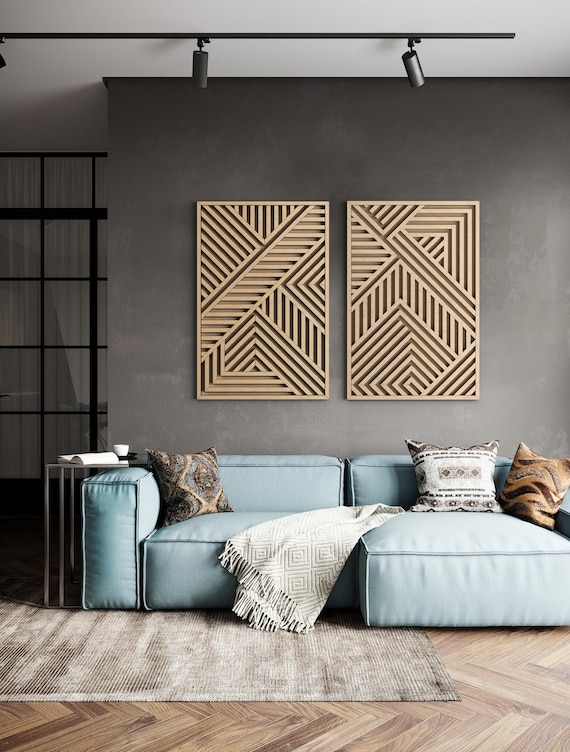
The width and height of the screenshot is (570, 752). I want to click on greek key pattern throw, so click(x=317, y=534).